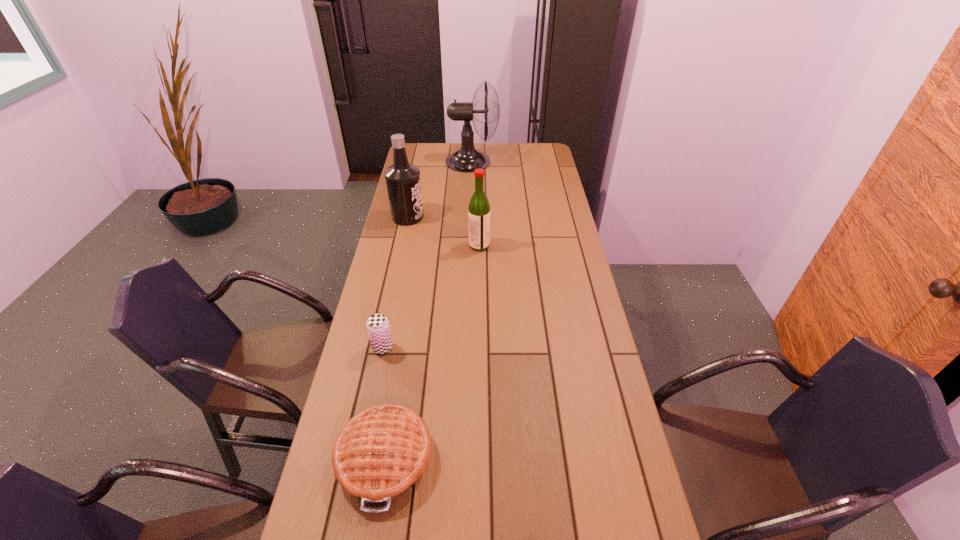
Find the location of a particular element. The height and width of the screenshot is (540, 960). vacant area located on the front label of the farther liquor is located at coordinates (491, 217).

Locate an element on the screen. This screenshot has width=960, height=540. vacant space located 0.120m on the label of the nearer liquor is located at coordinates (520, 246).

The height and width of the screenshot is (540, 960). Find the location of `free space located on the front of the fourth tallest object`. free space located on the front of the fourth tallest object is located at coordinates (371, 406).

Image resolution: width=960 pixels, height=540 pixels. In order to click on free region located 0.100m on the back of the nearest object in this screenshot , I will do `click(398, 378)`.

This screenshot has width=960, height=540. I want to click on object that is at the far edge, so click(467, 159).

Where is `liquor at the left edge`? The width and height of the screenshot is (960, 540). liquor at the left edge is located at coordinates (403, 184).

This screenshot has width=960, height=540. I want to click on beer can that is at the left edge, so click(x=377, y=325).

The height and width of the screenshot is (540, 960). Identify the location of pie situated at the left edge. click(380, 454).

What are the coordinates of `vacant region at the far edge of the desktop` in the screenshot? It's located at (449, 144).

This screenshot has width=960, height=540. In the image, there is a desktop. In order to click on free space at the left edge in this screenshot , I will do tap(416, 165).